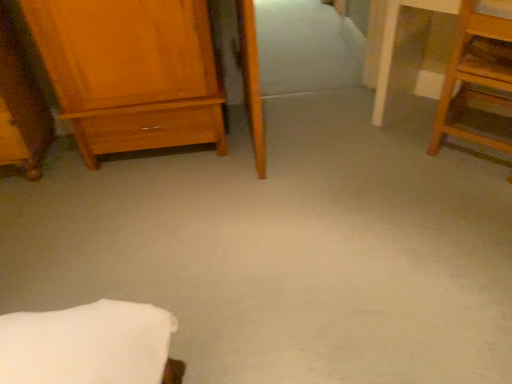
Question: Is matte wood chest of drawers at left inside or outside of wooden step stool at right, acting as the first furniture starting from the right?

Choices:
 (A) outside
 (B) inside

Answer: (A)

Question: From the image's perspective, relative to wooden step stool at right, acting as the first furniture starting from the right, is matte wood chest of drawers at left above or below?

Choices:
 (A) above
 (B) below

Answer: (A)

Question: Considering the real-world distances, which object is farthest from the wooden wardrobe at left, the second furniture viewed from the right?

Choices:
 (A) wooden step stool at right, acting as the first furniture starting from the right
 (B) matte wood chest of drawers at left

Answer: (A)

Question: Estimate the real-world distances between objects in this image. Which object is closer to the wooden wardrobe at left, which ranks as the 1th furniture in left-to-right order?

Choices:
 (A) matte wood chest of drawers at left
 (B) wooden step stool at right, acting as the first furniture starting from the right

Answer: (A)